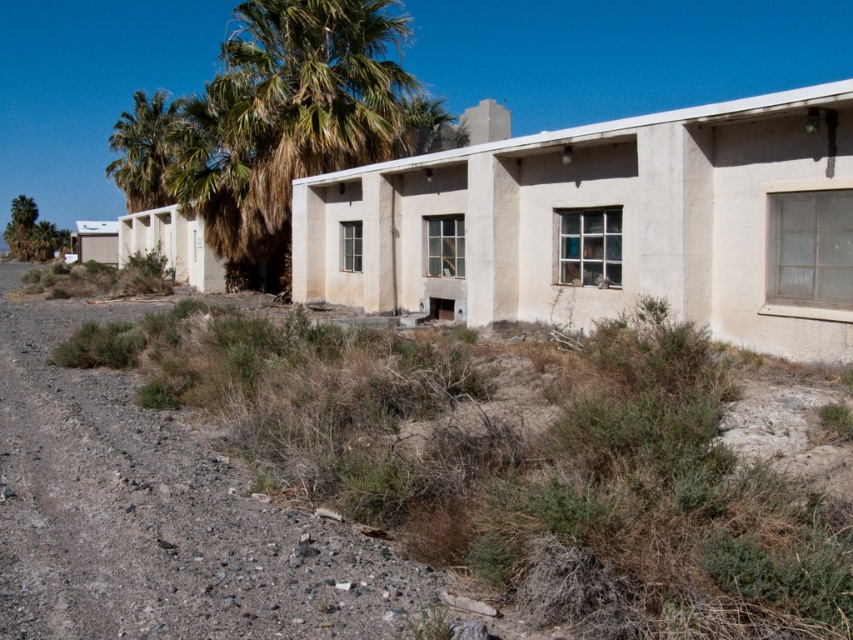
You are standing at the dusty gravel path at lower left and want to reach the green leafy palm tree at upper left. Which direction should you move in to get there?

You should move upwards to reach the green leafy palm tree at upper left since the dusty gravel path at lower left is located below it.

You are standing at the point with coordinates point [126,161] and want to walk to the entrance of the building. There is another point at point [331,550]. Which direction should you walk to reach the entrance without passing through the building?

You should walk towards point [331,550] because it is in front of point [126,161], meaning it is closer to the entrance and not obstructed by the building.

You are standing 5 meters away from the building. There is a point at coordinates point [281,566] that you want to reach. Can you walk directly to it without moving closer than 4 meters to the building?

The distance of point [281,566] from viewer is 4.77 meters, so yes, you can walk directly to it without moving closer than 4 meters to the building since 4.77 meters is greater than 4 meters.